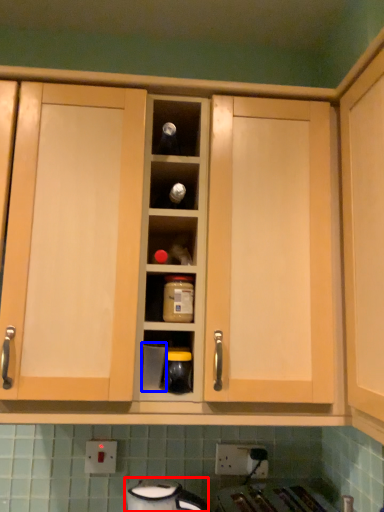
Question: Which object appears closest to the camera in this image, appliance (highlighted by a red box) or appliance (highlighted by a blue box)?

Choices:
 (A) appliance
 (B) appliance

Answer: (A)